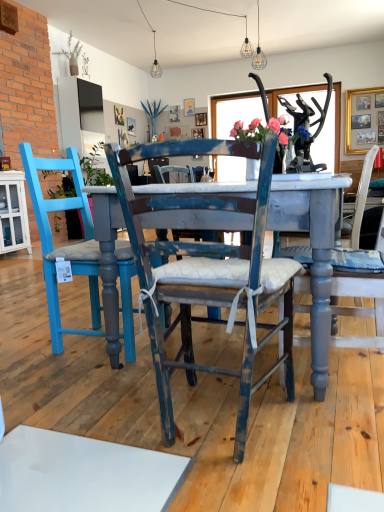
Question: Is gold-framed picture at upper right looking in the opposite direction of distressed blue chair at center, which appears as the 2th chair when viewed from the right?

Choices:
 (A) no
 (B) yes

Answer: (A)

Question: Is gold-framed picture at upper right outside of distressed blue chair at center, which appears as the 2th chair when viewed from the right?

Choices:
 (A) no
 (B) yes

Answer: (B)

Question: Considering the relative sizes of gold-framed picture at upper right and distressed blue chair at center, which appears as the 2th chair when viewed from the right, in the image provided, is gold-framed picture at upper right smaller than distressed blue chair at center, which appears as the 2th chair when viewed from the right,?

Choices:
 (A) no
 (B) yes

Answer: (B)

Question: Is gold-framed picture at upper right facing towards distressed blue chair at center, which appears as the 2th chair when viewed from the right?

Choices:
 (A) yes
 (B) no

Answer: (A)

Question: From a real-world perspective, is gold-framed picture at upper right physically below distressed blue chair at center, which appears as the 2th chair when viewed from the right?

Choices:
 (A) yes
 (B) no

Answer: (B)

Question: Are gold-framed picture at upper right and distressed blue chair at center, which appears as the 2th chair when viewed from the right, making contact?

Choices:
 (A) yes
 (B) no

Answer: (B)

Question: Considering the relative sizes of blue painted wood chair at left, the 1th chair positioned from the left, and distressed blue chair at center, acting as the second chair starting from the left, in the image provided, is blue painted wood chair at left, the 1th chair positioned from the left, shorter than distressed blue chair at center, acting as the second chair starting from the left,?

Choices:
 (A) no
 (B) yes

Answer: (A)

Question: Could distressed blue chair at center, acting as the second chair starting from the left, be considered to be inside blue painted wood chair at left, the 1th chair positioned from the left?

Choices:
 (A) no
 (B) yes

Answer: (A)

Question: From the image's perspective, is blue painted wood chair at left, the 1th chair positioned from the left, on top of distressed blue chair at center, acting as the second chair starting from the left?

Choices:
 (A) yes
 (B) no

Answer: (A)

Question: Can you confirm if blue painted wood chair at left, positioned as the 3th chair in right-to-left order, is taller than distressed blue chair at center, acting as the second chair starting from the left?

Choices:
 (A) yes
 (B) no

Answer: (A)

Question: From a real-world perspective, is blue painted wood chair at left, the 1th chair positioned from the left, positioned under distressed blue chair at center, acting as the second chair starting from the left, based on gravity?

Choices:
 (A) yes
 (B) no

Answer: (B)

Question: Considering the relative positions of blue painted wood chair at left, the 1th chair positioned from the left, and distressed blue chair at center, which appears as the 2th chair when viewed from the right, in the image provided, is blue painted wood chair at left, the 1th chair positioned from the left, to the right of distressed blue chair at center, which appears as the 2th chair when viewed from the right, from the viewer's perspective?

Choices:
 (A) yes
 (B) no

Answer: (B)

Question: Does matte blue vase with pink roses at center have a lesser width compared to distressed blue chair at center, which appears as the 2th chair when viewed from the right?

Choices:
 (A) yes
 (B) no

Answer: (A)